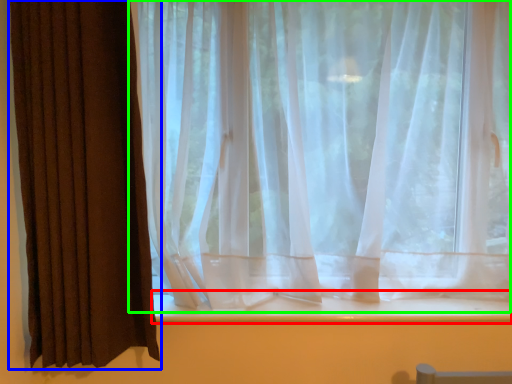
Question: Which is nearer to the window sill (highlighted by a red box)? curtain (highlighted by a blue box) or curtain (highlighted by a green box).

Choices:
 (A) curtain
 (B) curtain

Answer: (B)